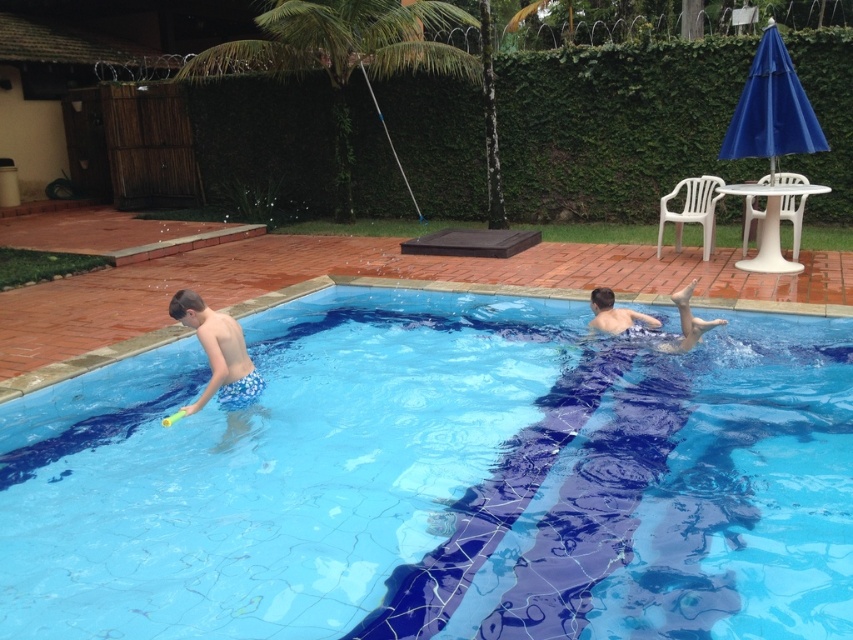
Find the location of a particular element. This screenshot has width=853, height=640. blue printed shorts at lower left is located at coordinates (219, 364).

This screenshot has height=640, width=853. Find the location of `blue printed shorts at lower left`. blue printed shorts at lower left is located at coordinates (219, 364).

Is blue mosaic tiles at center smaller than blue printed shorts at lower left?

No.

Is blue mosaic tiles at center shorter than blue printed shorts at lower left?

Indeed, blue mosaic tiles at center has a lesser height compared to blue printed shorts at lower left.

At what (x,y) coordinates should I click in order to perform the action: click on blue mosaic tiles at center. Please return your answer as a coordinate pair (x, y). The height and width of the screenshot is (640, 853). Looking at the image, I should click on (440, 483).

Identify the location of blue mosaic tiles at center. (440, 483).

The image size is (853, 640). What do you see at coordinates (440, 483) in the screenshot? I see `blue mosaic tiles at center` at bounding box center [440, 483].

Can you confirm if blue mosaic tiles at center is positioned above smooth skin person at center?

Incorrect, blue mosaic tiles at center is not positioned above smooth skin person at center.

Where is `blue mosaic tiles at center`? This screenshot has height=640, width=853. blue mosaic tiles at center is located at coordinates (440, 483).